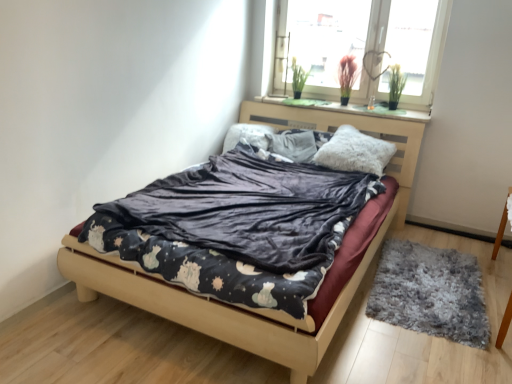
Question: From a real-world perspective, does white fluffy pillow at center, which appears as the 1th pillow when viewed from the right, sit lower than gray shaggy rug at lower right?

Choices:
 (A) yes
 (B) no

Answer: (B)

Question: Are white fluffy pillow at center, which appears as the 1th pillow when viewed from the right, and gray shaggy rug at lower right beside each other?

Choices:
 (A) no
 (B) yes

Answer: (A)

Question: Can you confirm if white fluffy pillow at center, which appears as the 1th pillow when viewed from the right, is positioned to the right of gray shaggy rug at lower right?

Choices:
 (A) yes
 (B) no

Answer: (B)

Question: Is white fluffy pillow at center, the third pillow when ordered from left to right, completely or partially outside of gray shaggy rug at lower right?

Choices:
 (A) no
 (B) yes

Answer: (B)

Question: Can you confirm if white fluffy pillow at center, the third pillow when ordered from left to right, is wider than gray shaggy rug at lower right?

Choices:
 (A) no
 (B) yes

Answer: (A)

Question: Does point (360, 216) appear closer or farther from the camera than point (285, 147)?

Choices:
 (A) farther
 (B) closer

Answer: (B)

Question: Is velvet dark blue bed at center spatially inside fluffy white pillow at center, which is the 2th pillow in right-to-left order, or outside of it?

Choices:
 (A) outside
 (B) inside

Answer: (A)

Question: Is velvet dark blue bed at center in front of or behind fluffy white pillow at center, which is the 2th pillow in right-to-left order, in the image?

Choices:
 (A) behind
 (B) front

Answer: (B)

Question: From their relative heights in the image, would you say velvet dark blue bed at center is taller or shorter than fluffy white pillow at center, which is the 2th pillow in right-to-left order?

Choices:
 (A) tall
 (B) short

Answer: (B)

Question: Considering the relative positions of gray shaggy rug at lower right and velvet dark blue bed at center in the image provided, is gray shaggy rug at lower right to the left or to the right of velvet dark blue bed at center?

Choices:
 (A) right
 (B) left

Answer: (A)

Question: Looking at the image, does gray shaggy rug at lower right seem bigger or smaller compared to velvet dark blue bed at center?

Choices:
 (A) big
 (B) small

Answer: (B)

Question: Is gray shaggy rug at lower right taller or shorter than velvet dark blue bed at center?

Choices:
 (A) short
 (B) tall

Answer: (B)

Question: Is gray shaggy rug at lower right wider or thinner than velvet dark blue bed at center?

Choices:
 (A) thin
 (B) wide

Answer: (A)

Question: Considering their positions, is white fluffy pillow at center, the third pillow when ordered from left to right, located in front of or behind velvet dark blue bed at center?

Choices:
 (A) front
 (B) behind

Answer: (B)

Question: Does point (337, 160) appear closer or farther from the camera than point (304, 379)?

Choices:
 (A) closer
 (B) farther

Answer: (B)